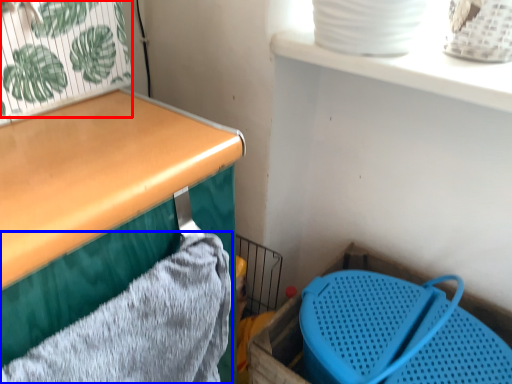
Question: Among these objects, which one is nearest to the camera, plant (highlighted by a red box) or bath towel (highlighted by a blue box)?

Choices:
 (A) plant
 (B) bath towel

Answer: (B)